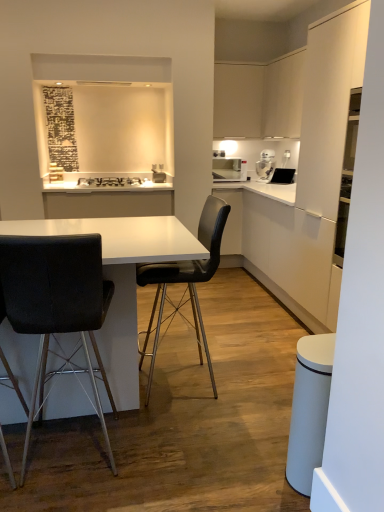
Looking at this image, measure the distance between matte white microwave at upper right and camera.

The depth of matte white microwave at upper right is 4.68 meters.

What are the coordinates of `white glossy coffee machine at upper right` in the screenshot? It's located at (266, 165).

Image resolution: width=384 pixels, height=512 pixels. What do you see at coordinates (109, 182) in the screenshot?
I see `black matte stove at upper center` at bounding box center [109, 182].

Describe the element at coordinates (56, 304) in the screenshot. Image resolution: width=384 pixels, height=512 pixels. I see `black leather chair at left, the 1th chair when ordered from left to right` at that location.

Locate an element on the screen. black leather chair at center, arranged as the first chair when viewed from the right is located at coordinates (185, 282).

At what (x,y) coordinates should I click in order to perform the action: click on white glossy table at center. Please return your answer as a coordinate pair (x, y). The height and width of the screenshot is (512, 384). Looking at the image, I should click on (121, 280).

How many degrees apart are the facing directions of matte white microwave at upper right and white glossy table at center?

There is a 179-degree angle between the facing directions of matte white microwave at upper right and white glossy table at center.

Considering the sizes of objects matte white microwave at upper right and white glossy table at center in the image provided, who is wider, matte white microwave at upper right or white glossy table at center?

white glossy table at center is wider.

Locate an element on the screen. The height and width of the screenshot is (512, 384). table below the matte white microwave at upper right (from the image's perspective) is located at coordinates (121, 280).

Is black matte stove at upper center facing away from white glossy table at center?

black matte stove at upper center is not turned away from white glossy table at center.

Can you confirm if black matte stove at upper center is shorter than white glossy table at center?

Yes, black matte stove at upper center is shorter than white glossy table at center.

Can you confirm if black matte stove at upper center is thinner than white glossy table at center?

Correct, the width of black matte stove at upper center is less than that of white glossy table at center.

Does black matte stove at upper center touch white glossy table at center?

No, black matte stove at upper center is not making contact with white glossy table at center.

Between white glossy table at center and black leather chair at left, the 1th chair when ordered from left to right, which one has less height?

With less height is white glossy table at center.

Considering the sizes of objects white glossy table at center and black leather chair at left, the 1th chair when ordered from left to right, in the image provided, who is smaller, white glossy table at center or black leather chair at left, the 1th chair when ordered from left to right,?

black leather chair at left, the 1th chair when ordered from left to right.

Are white glossy table at center and black leather chair at left, acting as the 2th chair starting from the right, far apart?

No.

Which object is further away from the camera, white glossy table at center or black leather chair at left, the 1th chair when ordered from left to right?

Positioned behind is white glossy table at center.

From the image's perspective, is white glossy coffee machine at upper right above white matte cabinet at right?

Correct, white glossy coffee machine at upper right appears higher than white matte cabinet at right in the image.

Measure the distance from white glossy coffee machine at upper right to white matte cabinet at right.

A distance of 4.03 feet exists between white glossy coffee machine at upper right and white matte cabinet at right.

Between white glossy coffee machine at upper right and white matte cabinet at right, which one appears on the right side from the viewer's perspective?

From the viewer's perspective, white matte cabinet at right appears more on the right side.

Is white glossy coffee machine at upper right behind white matte cabinet at right?

Yes, white glossy coffee machine at upper right is further from the viewer.

Would you say white glossy table at center is to the left or to the right of black matte stove at upper center in the picture?

From the image, it's evident that white glossy table at center is to the right of black matte stove at upper center.

In terms of height, does white glossy table at center look taller or shorter compared to black matte stove at upper center?

white glossy table at center is taller than black matte stove at upper center.

Which of these two, white glossy table at center or black matte stove at upper center, is wider?

Wider between the two is white glossy table at center.

Could black matte stove at upper center be considered to be inside white glossy table at center?

Actually, black matte stove at upper center is outside white glossy table at center.

Which is more to the right, black matte stove at upper center or black leather chair at left, acting as the 2th chair starting from the right?

From the viewer's perspective, black leather chair at left, acting as the 2th chair starting from the right, appears more on the right side.

From a real-world perspective, who is located lower, black matte stove at upper center or black leather chair at left, the 1th chair when ordered from left to right?

In real-world perspective, black leather chair at left, the 1th chair when ordered from left to right, is lower.

How different are the orientations of black matte stove at upper center and black leather chair at left, the 1th chair when ordered from left to right, in degrees?

The angular difference between black matte stove at upper center and black leather chair at left, the 1th chair when ordered from left to right, is 178 degrees.

Which of these two, black matte stove at upper center or black leather chair at left, the 1th chair when ordered from left to right, is bigger?

black leather chair at left, the 1th chair when ordered from left to right, is bigger.

Locate an element on the screen. The height and width of the screenshot is (512, 384). table below the white matte cabinet at right (from a real-world perspective) is located at coordinates coord(121,280).

From a real-world perspective, does white glossy table at center sit lower than white matte cabinet at right?

Yes.

Considering the positions of point (163, 257) and point (259, 232), is point (163, 257) closer or farther from the camera than point (259, 232)?

Point (163, 257) appears to be closer to the viewer than point (259, 232).

Are white glossy table at center and white matte cabinet at right beside each other?

white glossy table at center and white matte cabinet at right are not in contact.

Locate an element on the screen. The width and height of the screenshot is (384, 512). table below the matte white microwave at upper right (from a real-world perspective) is located at coordinates (121, 280).

There is a white glossy table at center. What are the coordinates of `stove above it (from a real-world perspective)` in the screenshot? It's located at click(x=109, y=182).

Which object lies further to the anchor point matte white microwave at upper right, black matte stove at upper center or white glossy table at center?

white glossy table at center is positioned further to the anchor matte white microwave at upper right.

Estimate the real-world distances between objects in this image. Which object is closer to matte white microwave at upper right, black leather chair at center, arranged as the first chair when viewed from the right, or white glossy table at center?

black leather chair at center, arranged as the first chair when viewed from the right.

Looking at the image, which one is located closer to white matte cabinet at right, black leather chair at left, the 1th chair when ordered from left to right, or black matte stove at upper center?

Among the two, black matte stove at upper center is located nearer to white matte cabinet at right.

Considering their positions, is white glossy table at center positioned further to black leather chair at left, acting as the 2th chair starting from the right, than black matte stove at upper center?

Based on the image, black matte stove at upper center appears to be further to black leather chair at left, acting as the 2th chair starting from the right.

When comparing their distances from black leather chair at left, acting as the 2th chair starting from the right, does white matte cabinet at right or white glossy coffee machine at upper right seem further?

white glossy coffee machine at upper right is further to black leather chair at left, acting as the 2th chair starting from the right.

From the image, which object appears to be nearer to black leather chair at left, the 1th chair when ordered from left to right, white glossy table at center or white glossy coffee machine at upper right?

white glossy table at center is closer to black leather chair at left, the 1th chair when ordered from left to right.

Based on their spatial positions, is matte white microwave at upper right or white glossy coffee machine at upper right closer to black leather chair at center, arranged as the first chair when viewed from the right?

matte white microwave at upper right.

When comparing their distances from white glossy coffee machine at upper right, does black leather chair at left, acting as the 2th chair starting from the right, or black leather chair at center, arranged as the first chair when viewed from the right, seem further?

Based on the image, black leather chair at left, acting as the 2th chair starting from the right, appears to be further to white glossy coffee machine at upper right.

I want to click on cabinetry between white glossy table at center and matte white microwave at upper right along the z-axis, so coord(289,255).

Where is `chair positioned between white glossy table at center and white glossy coffee machine at upper right from near to far`? chair positioned between white glossy table at center and white glossy coffee machine at upper right from near to far is located at coordinates coord(185,282).

Identify the location of coffee machine between white glossy table at center and matte white microwave at upper right from front to back. This screenshot has height=512, width=384. (266, 165).

You are a GUI agent. You are given a task and a screenshot of the screen. Output one action in this format:
    pyautogui.click(x=<x>, y=<y>)
    Task: Click on the chair between black leather chair at left, acting as the 2th chair starting from the right, and black matte stove at upper center from front to back
    
    Given the screenshot: What is the action you would take?
    pyautogui.click(x=185, y=282)